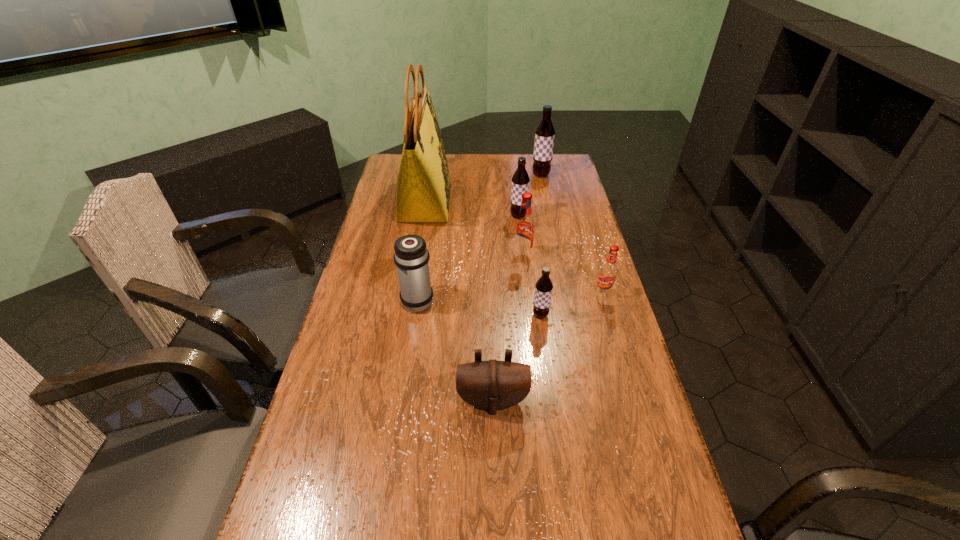
Locate an element on the screen. free region at the far edge is located at coordinates click(475, 178).

You are a GUI agent. You are given a task and a screenshot of the screen. Output one action in this format:
    pyautogui.click(x=<x>, y=<y>)
    Task: Click on the free region at the left edge of the desktop
    Image resolution: width=960 pixels, height=540 pixels.
    Given the screenshot: What is the action you would take?
    pyautogui.click(x=319, y=410)

In the image, there is a desktop. Identify the location of vacant space at the right edge. (612, 336).

You are a GUI agent. You are given a task and a screenshot of the screen. Output one action in this format:
    pyautogui.click(x=<x>, y=<y>)
    Task: Click on the vacant space at the far right corner of the desktop
    The width and height of the screenshot is (960, 540).
    Given the screenshot: What is the action you would take?
    pyautogui.click(x=553, y=164)

In order to click on vacant area that lies between the tallest root beer and the thermos bottle in this screenshot , I will do `click(479, 238)`.

The height and width of the screenshot is (540, 960). I want to click on free area in between the tallest object and the farther red root beer, so click(x=474, y=229).

Locate an element on the screen. This screenshot has height=540, width=960. free space between the left red root beer and the shortest object is located at coordinates (508, 328).

Where is `free space between the fourth nearest root beer and the thermos bottle`? free space between the fourth nearest root beer and the thermos bottle is located at coordinates (468, 258).

You are a GUI agent. You are given a task and a screenshot of the screen. Output one action in this format:
    pyautogui.click(x=<x>, y=<y>)
    Task: Click on the free space between the second nearest brown root beer and the yellow tote bag
    This screenshot has width=960, height=540.
    Given the screenshot: What is the action you would take?
    pyautogui.click(x=471, y=210)

Image resolution: width=960 pixels, height=540 pixels. What are the coordinates of `free spot between the bigger red root beer and the thermos bottle` in the screenshot? It's located at (470, 278).